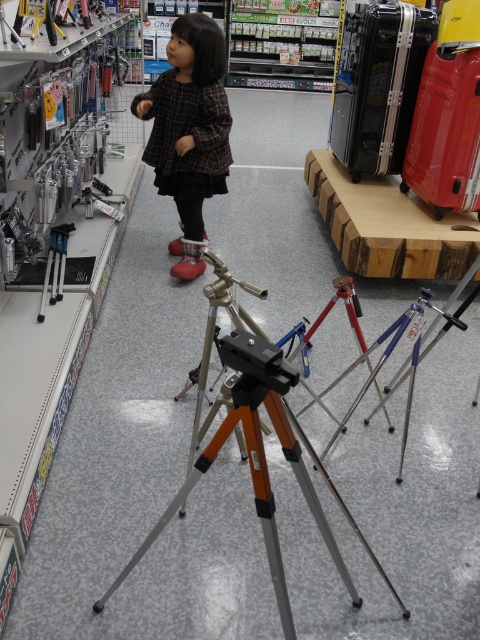
You are a customer in a photography store and see the silver metallic tripod at center and the plaid fabric dress at center. Which object is positioned to the right side from your perspective?

The silver metallic tripod at center is to the right of the plaid fabric dress at center.

You are standing in the retail store looking at the tripods displayed on the floor. There are two points marked in the scene, one at coordinates point (294, 452) and another at point (219, 125). Which of these two points is nearer to your current position as you look at the tripods?

Point (294, 452) is closer to the camera than point (219, 125), so the point at (294, 452) is nearer to your current position.

You are a customer in the store and want to pick up the plaid fabric dress at center. However, there is a silver metallic tripod at center in your way. Can you reach the dress without moving the tripod?

The silver metallic tripod at center is 5.80 feet away from plaid fabric dress at center. Since the distance between them is over 5 feet, you can easily reach the dress without moving the tripod.